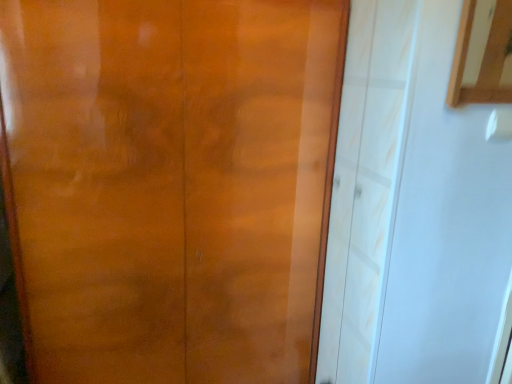
Question: From the image's perspective, is matte wood door at center located above or below light wood cabinet at upper right?

Choices:
 (A) above
 (B) below

Answer: (B)

Question: From a real-world perspective, is matte wood door at center physically located above or below light wood cabinet at upper right?

Choices:
 (A) below
 (B) above

Answer: (A)

Question: Which is correct: matte wood door at center is inside light wood cabinet at upper right, or outside of it?

Choices:
 (A) outside
 (B) inside

Answer: (A)

Question: From the image's perspective, is light wood cabinet at upper right above or below matte wood door at center?

Choices:
 (A) below
 (B) above

Answer: (B)

Question: Looking at the image, does light wood cabinet at upper right seem bigger or smaller compared to matte wood door at center?

Choices:
 (A) big
 (B) small

Answer: (B)

Question: Is point (477, 79) closer or farther from the camera than point (38, 360)?

Choices:
 (A) farther
 (B) closer

Answer: (A)

Question: From a real-world perspective, is light wood cabinet at upper right positioned above or below matte wood door at center?

Choices:
 (A) above
 (B) below

Answer: (A)